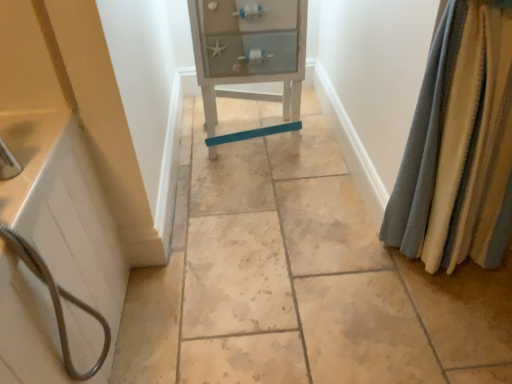
Locate an element on the screen. The image size is (512, 384). vacant space underneath velvet-like beige curtains at right (from a real-world perspective) is located at coordinates 425,273.